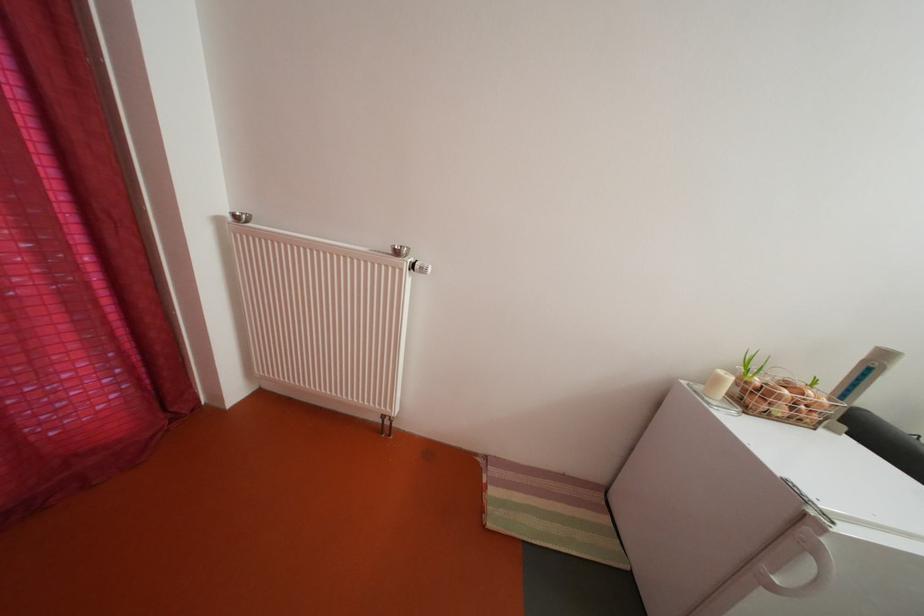
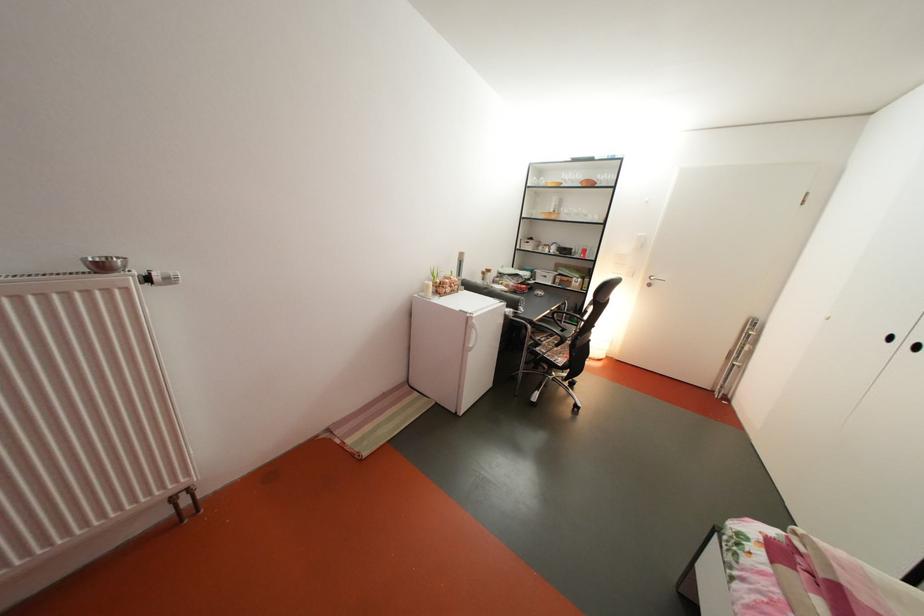
The point at [728,386] is marked in the first image. Where is the corresponding point in the second image?

(439, 293)